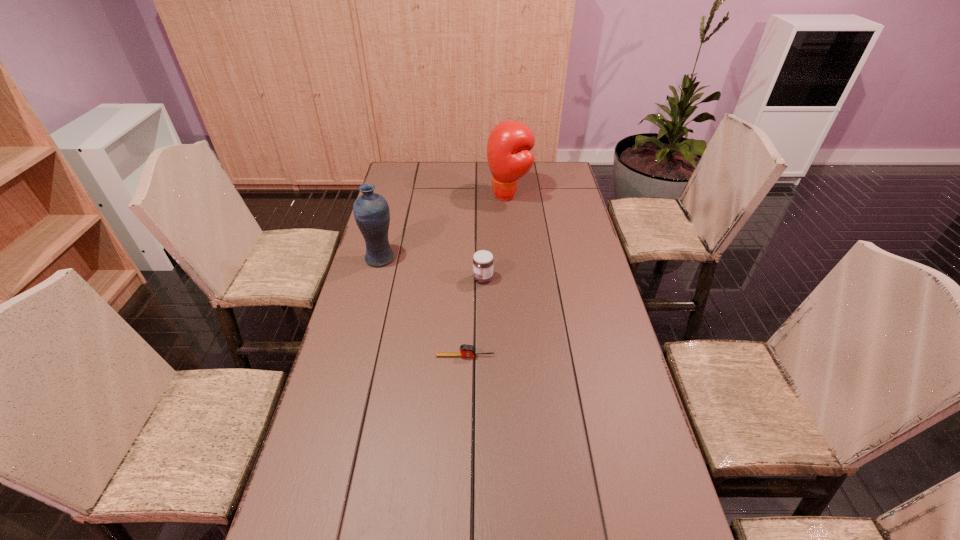
Where is `the farthest object`? This screenshot has height=540, width=960. the farthest object is located at coordinates (509, 146).

The image size is (960, 540). In order to click on the second farthest object in this screenshot , I will do `click(371, 211)`.

You are a GUI agent. You are given a task and a screenshot of the screen. Output one action in this format:
    pyautogui.click(x=<x>, y=<y>)
    Task: Click on the leftmost object
    This screenshot has height=540, width=960.
    Given the screenshot: What is the action you would take?
    pyautogui.click(x=371, y=211)

Find the location of `jam`. jam is located at coordinates (483, 261).

I want to click on the second shortest object, so click(483, 261).

The height and width of the screenshot is (540, 960). I want to click on the shortest object, so click(465, 350).

This screenshot has width=960, height=540. I want to click on tape measure, so click(x=465, y=350).

Find the location of a particular element. free space located 0.230m on the striking surface of the farthest object is located at coordinates (434, 195).

Where is `vacant area situated 0.220m on the striking surface of the farthest object`? This screenshot has width=960, height=540. vacant area situated 0.220m on the striking surface of the farthest object is located at coordinates (436, 195).

Identify the location of vacant area located 0.140m on the striking surface of the farthest object. (454, 195).